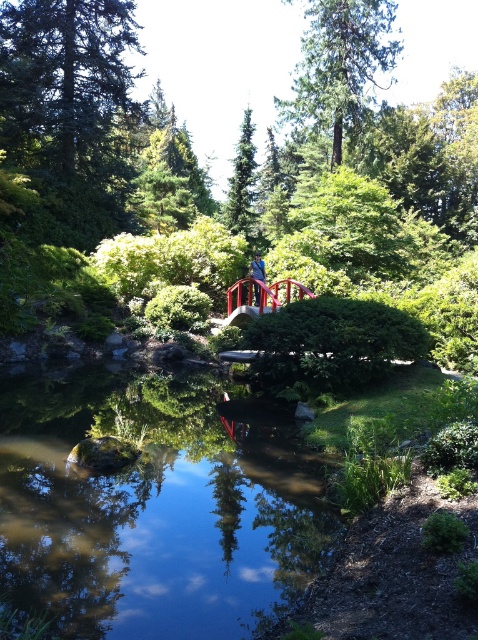
Is point (75, 493) closer to viewer compared to point (241, 298)?

Yes, point (75, 493) is in front of point (241, 298).

Is clear water at center to the right of metallic red bridge at center from the viewer's perspective?

No, clear water at center is not to the right of metallic red bridge at center.

Which is behind, point (67, 444) or point (212, 323)?

The point (212, 323) is more distant.

Where is `clear water at center`? This screenshot has width=478, height=640. clear water at center is located at coordinates (152, 509).

Between clear water at center and smooth red bridge at center, which one appears on the left side from the viewer's perspective?

From the viewer's perspective, clear water at center appears more on the left side.

Can you confirm if clear water at center is positioned above smooth red bridge at center?

No.

Is point (218, 532) positioned after point (261, 275)?

No, (218, 532) is in front of (261, 275).

You are a GUI agent. You are given a task and a screenshot of the screen. Output one action in this format:
    pyautogui.click(x=<x>, y=<y>)
    Task: Click on the clear water at center
    The height and width of the screenshot is (640, 478).
    Given the screenshot: What is the action you would take?
    pyautogui.click(x=152, y=509)

Based on the photo, which is above, metallic red bridge at center or smooth red bridge at center?

smooth red bridge at center is above.

In the scene shown: Does metallic red bridge at center have a larger size compared to smooth red bridge at center?

Correct, metallic red bridge at center is larger in size than smooth red bridge at center.

Image resolution: width=478 pixels, height=640 pixels. What do you see at coordinates (259, 300) in the screenshot?
I see `metallic red bridge at center` at bounding box center [259, 300].

Where is `metallic red bridge at center`? The height and width of the screenshot is (640, 478). metallic red bridge at center is located at coordinates (259, 300).